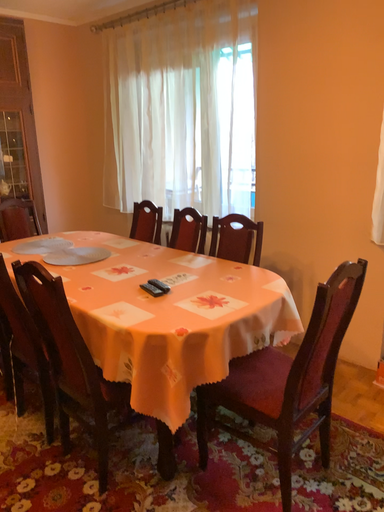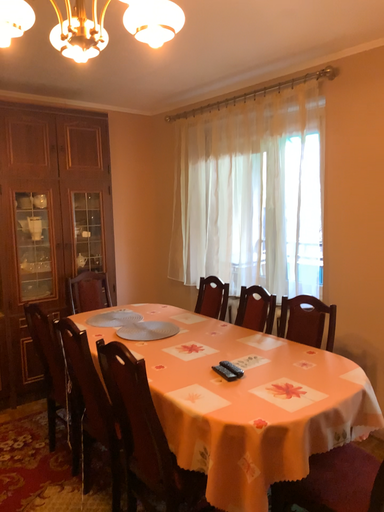
Question: Which way did the camera rotate in the video?

Choices:
 (A) rotated left
 (B) rotated right

Answer: (A)